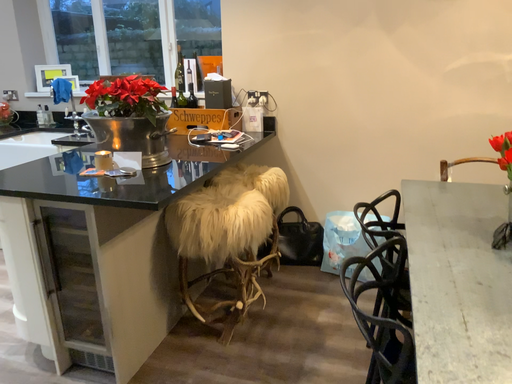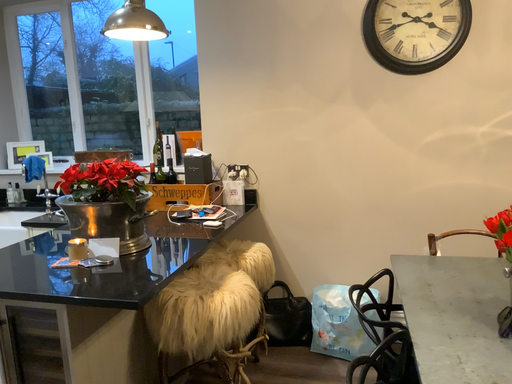
Question: How did the camera likely rotate when shooting the video?

Choices:
 (A) rotated downward
 (B) rotated upward

Answer: (B)